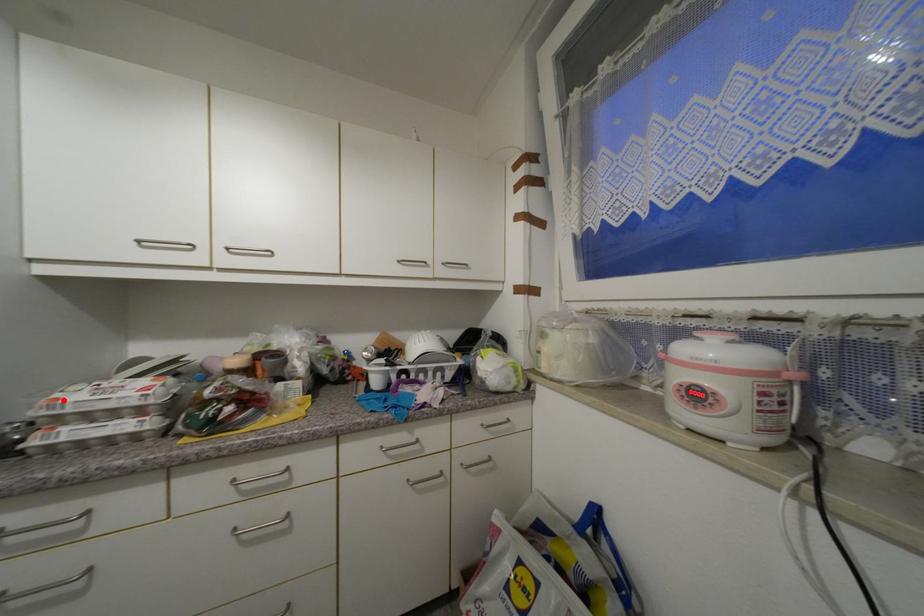
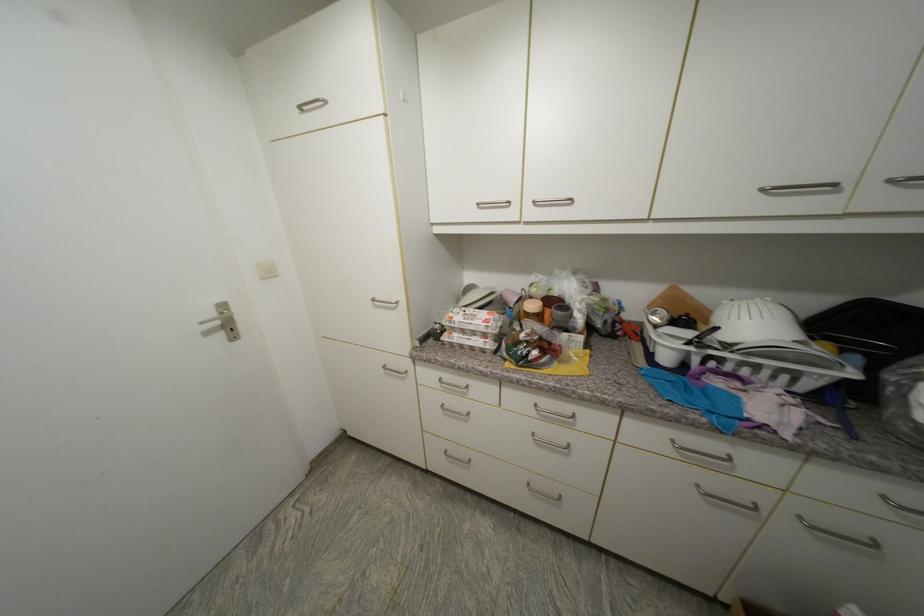
Locate, in the second image, the point that corresponds to the highlighted location in the first image.

(457, 318)